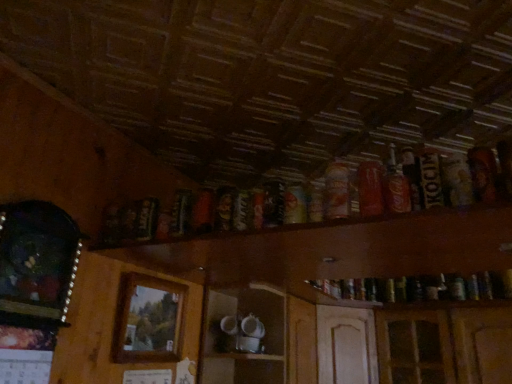
Question: Is dark brown glass bottle at left, positioned as the eighth beer in right-to-left order, bigger than matte red can at upper right, positioned as the second beer in right-to-left order?

Choices:
 (A) yes
 (B) no

Answer: (A)

Question: Would you say dark brown glass bottle at left, positioned as the eighth beer in right-to-left order, is a long distance from matte red can at upper right, which ranks as the 7th beer in left-to-right order?

Choices:
 (A) yes
 (B) no

Answer: (B)

Question: Is dark brown glass bottle at left, the first beer when ordered from left to right, to the right of matte red can at upper right, which ranks as the 7th beer in left-to-right order, from the viewer's perspective?

Choices:
 (A) yes
 (B) no

Answer: (B)

Question: Is dark brown glass bottle at left, the first beer when ordered from left to right, shorter than matte red can at upper right, which ranks as the 7th beer in left-to-right order?

Choices:
 (A) no
 (B) yes

Answer: (A)

Question: Can you confirm if dark brown glass bottle at left, the first beer when ordered from left to right, is taller than matte red can at upper right, which ranks as the 7th beer in left-to-right order?

Choices:
 (A) no
 (B) yes

Answer: (B)

Question: Relative to dark brown glass bottle at left, the first beer when ordered from left to right, is white glossy cups at center in front or behind?

Choices:
 (A) behind
 (B) front

Answer: (A)

Question: Considering the positions of point (273, 297) and point (142, 218), is point (273, 297) closer or farther from the camera than point (142, 218)?

Choices:
 (A) farther
 (B) closer

Answer: (A)

Question: Is white glossy cups at center spatially inside dark brown glass bottle at left, the first beer when ordered from left to right, or outside of it?

Choices:
 (A) inside
 (B) outside

Answer: (B)

Question: Would you say white glossy cups at center is to the left or to the right of dark brown glass bottle at left, the first beer when ordered from left to right, in the picture?

Choices:
 (A) right
 (B) left

Answer: (A)

Question: Is wooden frame at center, which appears as the 2th picture frame when viewed from the left, wider or thinner than dark brown cardboard beer can at upper right, placed as the 1th beer when sorted from right to left?

Choices:
 (A) thin
 (B) wide

Answer: (B)

Question: From a real-world perspective, relative to dark brown cardboard beer can at upper right, placed as the 1th beer when sorted from right to left, is wooden frame at center, the 1th picture frame positioned from the right, vertically above or below?

Choices:
 (A) above
 (B) below

Answer: (B)

Question: In terms of size, does wooden frame at center, which is the 2th picture frame from front to back, appear bigger or smaller than dark brown cardboard beer can at upper right, which appears as the eighth beer when viewed from the left?

Choices:
 (A) small
 (B) big

Answer: (B)

Question: Is wooden frame at center, which appears as the 2th picture frame when viewed from the left, situated inside dark brown cardboard beer can at upper right, placed as the 1th beer when sorted from right to left, or outside?

Choices:
 (A) inside
 (B) outside

Answer: (B)

Question: From a real-world perspective, relative to wooden picture frame at left, positioned as the 2th picture frame in back-to-front order, is dark brown glass bottle at left, positioned as the eighth beer in right-to-left order, vertically above or below?

Choices:
 (A) below
 (B) above

Answer: (B)

Question: From their relative heights in the image, would you say dark brown glass bottle at left, positioned as the eighth beer in right-to-left order, is taller or shorter than wooden picture frame at left, which ranks as the first picture frame in left-to-right order?

Choices:
 (A) tall
 (B) short

Answer: (B)